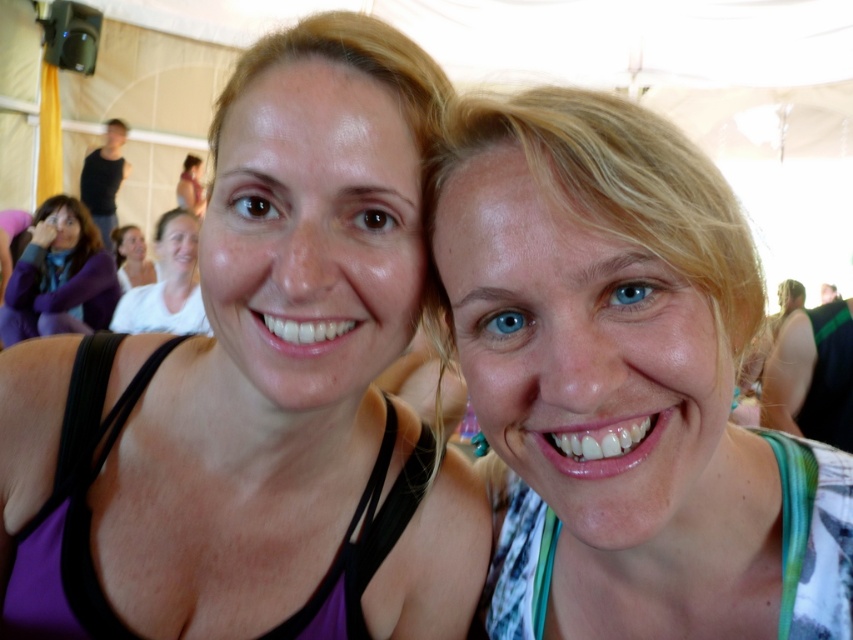
Question: Which of the following is the closest to the observer?

Choices:
 (A) matte white tank top at upper left
 (B) matte white tank top at center
 (C) matte pink tank top at upper left

Answer: (B)

Question: Does purple fabric tank top at left have a greater width compared to white printed tank top at right?

Choices:
 (A) no
 (B) yes

Answer: (B)

Question: Among these objects, which one is farthest from the camera?

Choices:
 (A) matte pink tank top at upper left
 (B) white printed tank top at right
 (C) purple fleece jacket at left
 (D) purple fabric tank top at left

Answer: (A)

Question: Which point is closer to the camera?

Choices:
 (A) (840, 552)
 (B) (196, 305)
 (C) (132, 230)
 (D) (80, 282)

Answer: (A)

Question: Can you confirm if matte white tank top at center is wider than matte pink tank top at upper left?

Choices:
 (A) no
 (B) yes

Answer: (B)

Question: Can you confirm if matte white tank top at center is positioned to the left of matte pink tank top at upper left?

Choices:
 (A) no
 (B) yes

Answer: (A)